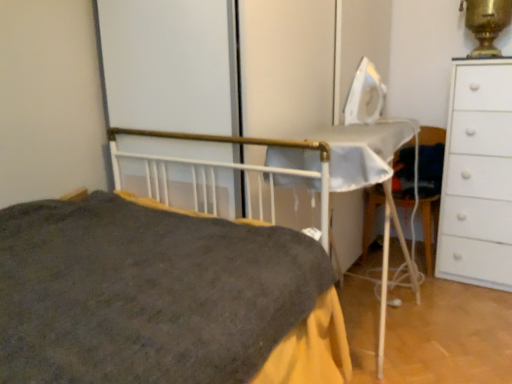
Question: In terms of width, does dark gray fabric bed at center look wider or thinner when compared to white matte chest of drawers at right?

Choices:
 (A) wide
 (B) thin

Answer: (A)

Question: Considering their positions, is dark gray fabric bed at center located in front of or behind white matte chest of drawers at right?

Choices:
 (A) front
 (B) behind

Answer: (A)

Question: Which is nearer to the white matte chest of drawers at right?

Choices:
 (A) white fabric chair at right
 (B) gold metallic samovar at upper right
 (C) dark gray fabric bed at center

Answer: (A)

Question: Which is nearer to the dark gray fabric bed at center?

Choices:
 (A) gold metallic samovar at upper right
 (B) white fabric chair at right
 (C) white matte chest of drawers at right

Answer: (C)